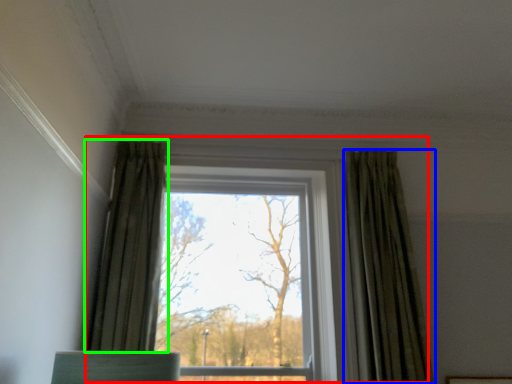
Question: Based on their relative distances, which object is nearer to window (highlighted by a red box)? Choose from curtain (highlighted by a blue box) and curtain (highlighted by a green box).

Choices:
 (A) curtain
 (B) curtain

Answer: (A)